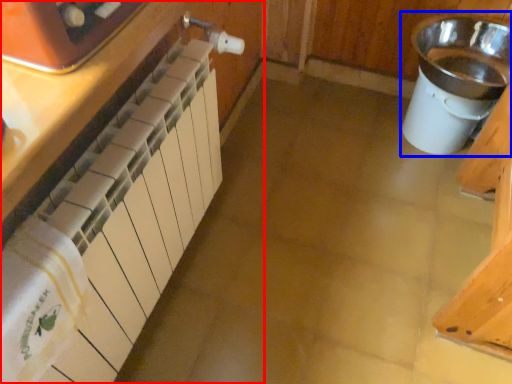
Question: Which object appears farthest to the camera in this image, cabinetry (highlighted by a red box) or sink (highlighted by a blue box)?

Choices:
 (A) cabinetry
 (B) sink

Answer: (B)